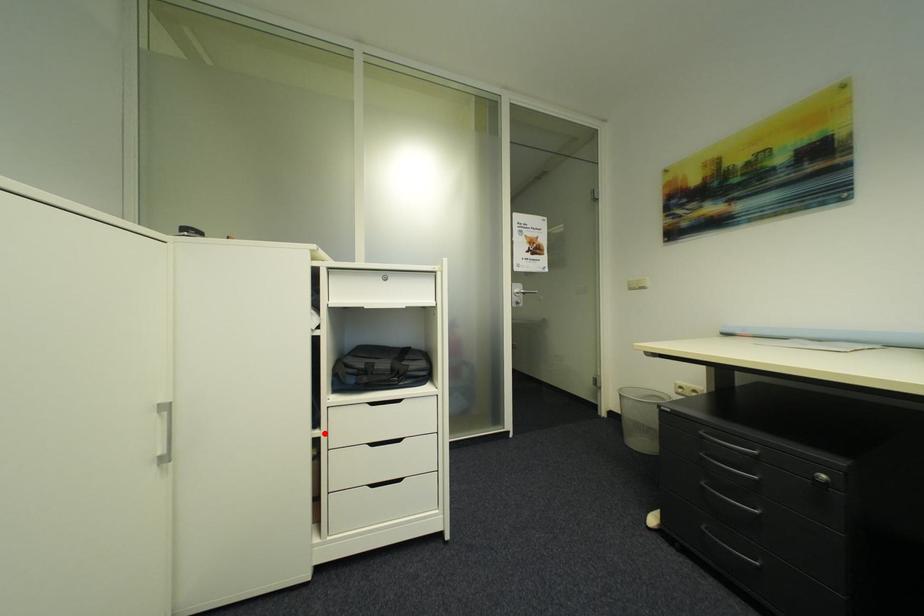
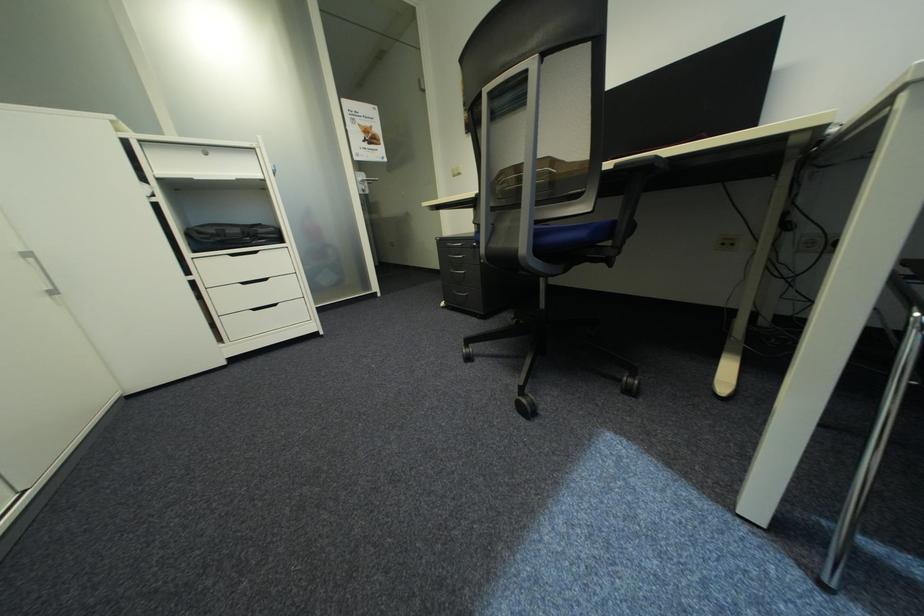
Question: I am providing you with two images of the same scene from different viewpoints. Given a red point in image1, look at the same physical point in image2. Is it:

Choices:
 (A) Closer to the viewpoint
 (B) Farther from the viewpoint

Answer: (A)